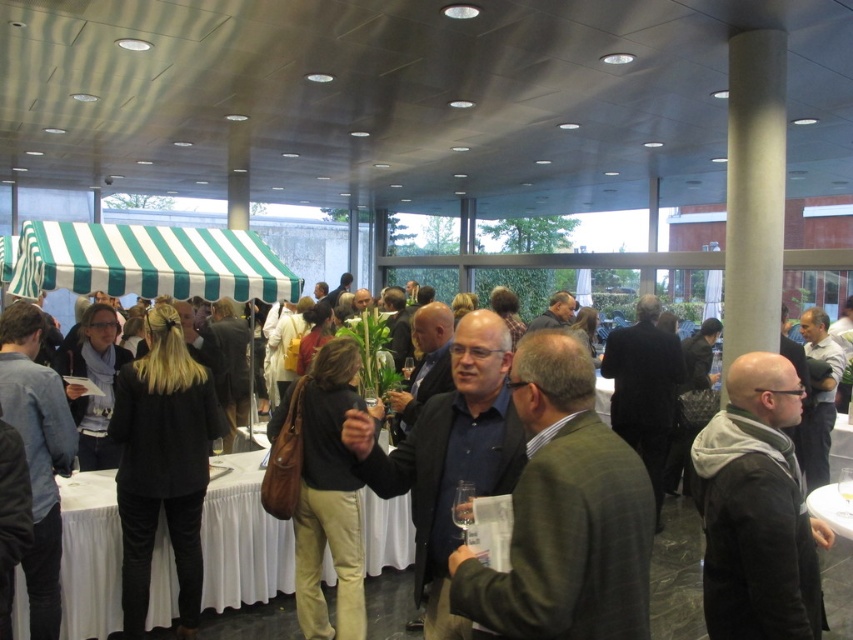
Question: Which point is closer to the camera?

Choices:
 (A) (386, 557)
 (B) (149, 355)
 (C) (850, 580)
 (D) (90, 476)

Answer: (B)

Question: Which point is closer to the camera?

Choices:
 (A) dark brown leather jacket at center
 (B) white clothed table at center
 (C) black fabric coat at center
 (D) leather handbag at center

Answer: (D)

Question: Is white clothed table at center thinner than leather handbag at center?

Choices:
 (A) yes
 (B) no

Answer: (B)

Question: Does dark brown leather jacket at center appear on the left side of black fabric coat at center?

Choices:
 (A) no
 (B) yes

Answer: (A)

Question: Can you confirm if leather handbag at center is positioned below white cloth table at lower right?

Choices:
 (A) yes
 (B) no

Answer: (B)

Question: Considering the real-world distances, which object is farthest from the white clothed table at center?

Choices:
 (A) white cloth table at lower right
 (B) black fabric coat at center
 (C) leather handbag at center
 (D) dark brown leather jacket at center

Answer: (A)